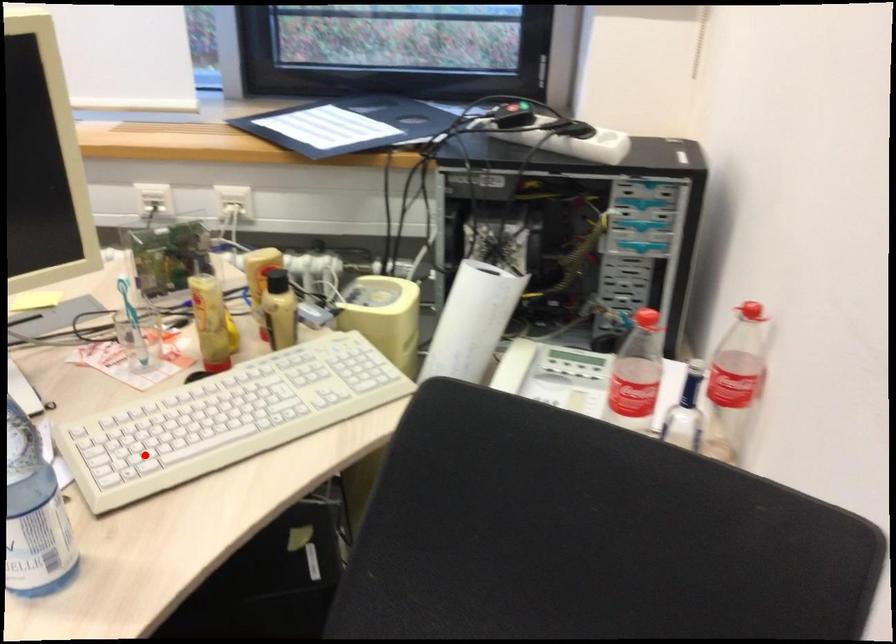
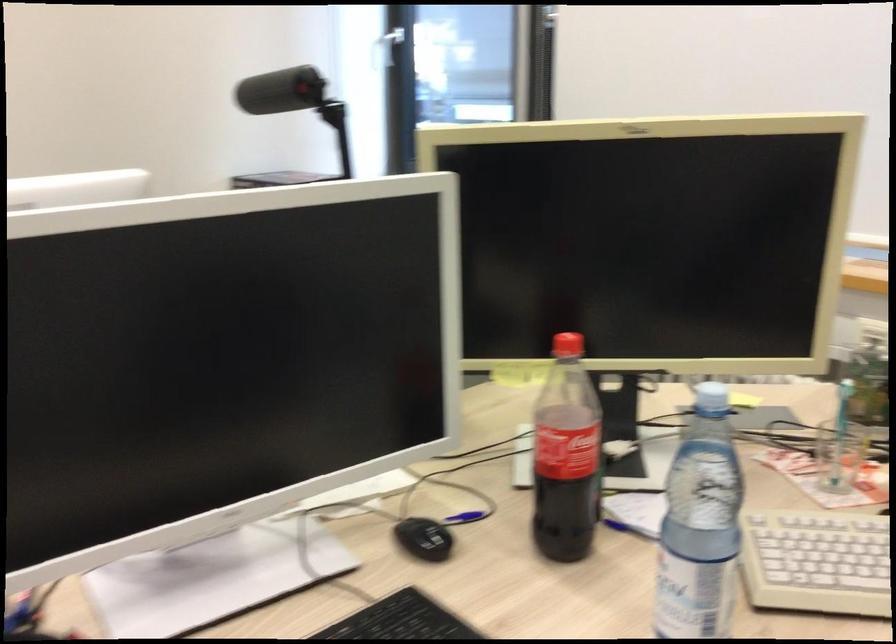
In the second image, find the point that corresponds to the highlighted location in the first image.

(815, 562)